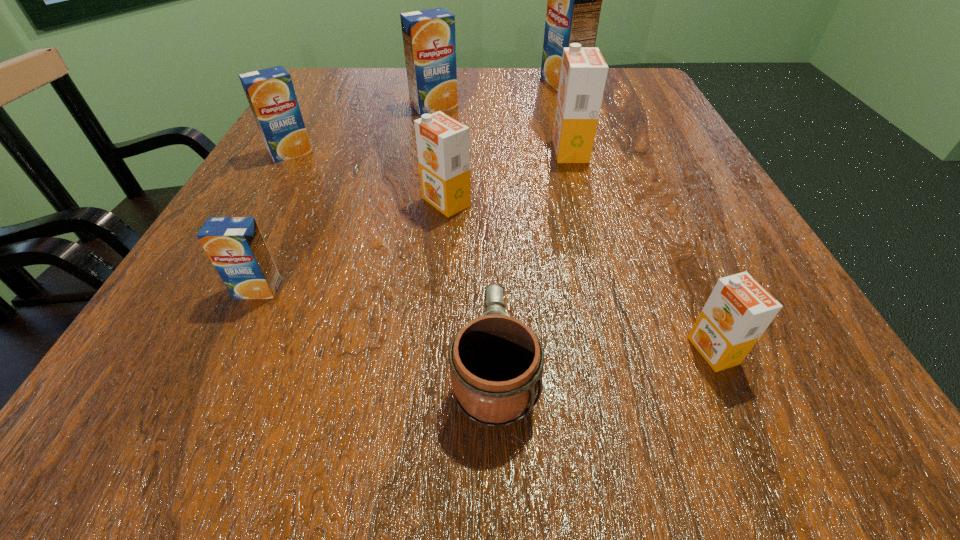
Identify the location of the smallest blue orange_juice. (235, 245).

Find the location of a particular element. Image resolution: width=960 pixels, height=540 pixels. the nearest orange juice is located at coordinates (738, 311).

The height and width of the screenshot is (540, 960). Identify the location of the rightmost object. (738, 311).

I want to click on mug, so click(496, 362).

This screenshot has height=540, width=960. Find the location of `vacant space located on the front of the farthest object`. vacant space located on the front of the farthest object is located at coordinates (580, 136).

The width and height of the screenshot is (960, 540). What are the coordinates of `free space located on the front of the sixth nearest orange juice` in the screenshot? It's located at (431, 127).

Find the location of a particular element. The width and height of the screenshot is (960, 540). free point located 0.400m on the front of the second orange orange juice from right to left is located at coordinates (623, 347).

I want to click on vacant space positioned 0.120m on the front of the second nearest blue orange_juice, so 261,204.

You are a GUI agent. You are given a task and a screenshot of the screen. Output one action in this format:
    pyautogui.click(x=<x>, y=<y>)
    Task: Click on the vacant space located on the right of the second nearest orange orange juice
    Image resolution: width=960 pixels, height=540 pixels.
    Given the screenshot: What is the action you would take?
    pyautogui.click(x=612, y=202)

Image resolution: width=960 pixels, height=540 pixels. I want to click on vacant space located on the front of the nearest blue orange_juice, so click(215, 381).